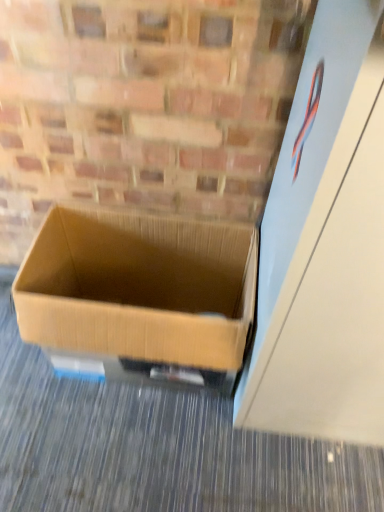
You are a GUI agent. You are given a task and a screenshot of the screen. Output one action in this format:
    pyautogui.click(x=<x>, y=<y>)
    Task: Click on the unoccupied area in front of brown cardboard box at lower left
    The width and height of the screenshot is (384, 512).
    Given the screenshot: What is the action you would take?
    pyautogui.click(x=134, y=453)